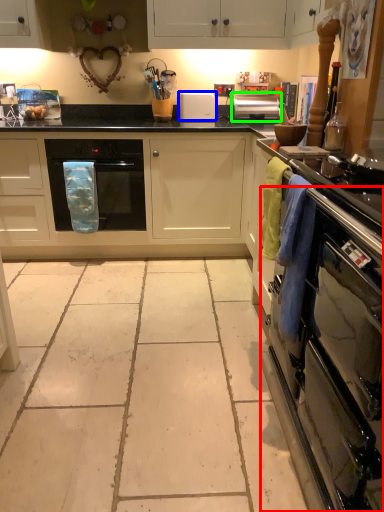
Question: Based on their relative distances, which object is farther from oven (highlighted by a red box)? Choose from appliance (highlighted by a blue box) and kitchen appliance (highlighted by a green box).

Choices:
 (A) appliance
 (B) kitchen appliance

Answer: (A)